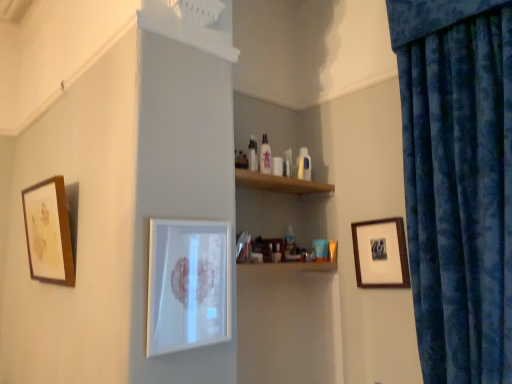
This screenshot has width=512, height=384. I want to click on velvety blue curtain at right, so click(458, 182).

How much space does wooden framed print at right, the third picture frame in the left-to-right sequence, occupy horizontally?

wooden framed print at right, the third picture frame in the left-to-right sequence, is 1.50 inches wide.

What do you see at coordinates (188, 285) in the screenshot? I see `white glossy picture frame at center, the 2th picture frame from the left` at bounding box center [188, 285].

Where is `velvety blue curtain at right`? The width and height of the screenshot is (512, 384). velvety blue curtain at right is located at coordinates (458, 182).

Is wooden framed print at right, the third picture frame in the left-to-right sequence, in front of or behind wooden framed artwork at left, positioned as the 3th picture frame in right-to-left order, in the image?

In the image, wooden framed print at right, the third picture frame in the left-to-right sequence, appears behind wooden framed artwork at left, positioned as the 3th picture frame in right-to-left order.

Is wooden framed print at right, which is the 1th picture frame in right-to-left order, positioned with its back to wooden framed artwork at left, the first picture frame from the left?

No.

Is wooden framed print at right, which is the 1th picture frame in right-to-left order, bigger than wooden framed artwork at left, the first picture frame from the left?

Actually, wooden framed print at right, which is the 1th picture frame in right-to-left order, might be smaller than wooden framed artwork at left, the first picture frame from the left.

Considering the relative sizes of wooden framed print at right, which is the 1th picture frame in right-to-left order, and wooden framed artwork at left, the first picture frame from the left, in the image provided, is wooden framed print at right, which is the 1th picture frame in right-to-left order, wider than wooden framed artwork at left, the first picture frame from the left,?

No, wooden framed print at right, which is the 1th picture frame in right-to-left order, is not wider than wooden framed artwork at left, the first picture frame from the left.

Is wooden framed print at right, which is the 1th picture frame in right-to-left order, thinner than velvety blue curtain at right?

Indeed, wooden framed print at right, which is the 1th picture frame in right-to-left order, has a lesser width compared to velvety blue curtain at right.

Is there a large distance between wooden framed print at right, which is the 1th picture frame in right-to-left order, and velvety blue curtain at right?

wooden framed print at right, which is the 1th picture frame in right-to-left order, is actually quite close to velvety blue curtain at right.

From a real-world perspective, relative to velvety blue curtain at right, is wooden framed print at right, the third picture frame in the left-to-right sequence, vertically above or below?

wooden framed print at right, the third picture frame in the left-to-right sequence, is below velvety blue curtain at right.

From the image's perspective, which is below, wooden framed print at right, which is the 1th picture frame in right-to-left order, or velvety blue curtain at right?

wooden framed print at right, which is the 1th picture frame in right-to-left order, appears lower in the image.

Considering the positions of objects wooden framed print at right, which is the 1th picture frame in right-to-left order, and white glossy picture frame at center, the 2th picture frame from the left, in the image provided, who is behind, wooden framed print at right, which is the 1th picture frame in right-to-left order, or white glossy picture frame at center, the 2th picture frame from the left,?

wooden framed print at right, which is the 1th picture frame in right-to-left order, is behind.

From the picture: How different are the orientations of wooden framed print at right, which is the 1th picture frame in right-to-left order, and white glossy picture frame at center, placed as the 2th picture frame when sorted from right to left, in degrees?

They differ by 89.9 degrees in their facing directions.

Identify the location of picture frame located underneath the wooden framed print at right, the third picture frame in the left-to-right sequence (from a real-world perspective). (188, 285).

From a real-world perspective, is wooden framed print at right, the third picture frame in the left-to-right sequence, above or below white glossy picture frame at center, the 2th picture frame from the left?

From a real-world perspective, wooden framed print at right, the third picture frame in the left-to-right sequence, is physically above white glossy picture frame at center, the 2th picture frame from the left.

From a real-world perspective, is wooden framed artwork at left, the first picture frame from the left, below white glossy picture frame at center, the 2th picture frame from the left?

No.

From the image's perspective, which object appears higher, wooden framed artwork at left, the first picture frame from the left, or white glossy picture frame at center, placed as the 2th picture frame when sorted from right to left?

wooden framed artwork at left, the first picture frame from the left, appears higher in the image.

Does wooden framed artwork at left, the first picture frame from the left, lie in front of white glossy picture frame at center, placed as the 2th picture frame when sorted from right to left?

No, wooden framed artwork at left, the first picture frame from the left, is further to the viewer.

In terms of width, does white glossy picture frame at center, placed as the 2th picture frame when sorted from right to left, look wider or thinner when compared to velvety blue curtain at right?

white glossy picture frame at center, placed as the 2th picture frame when sorted from right to left, is thinner than velvety blue curtain at right.

From the image's perspective, which one is positioned lower, white glossy picture frame at center, the 2th picture frame from the left, or velvety blue curtain at right?

white glossy picture frame at center, the 2th picture frame from the left.

Considering their positions, is white glossy picture frame at center, placed as the 2th picture frame when sorted from right to left, located in front of or behind velvety blue curtain at right?

white glossy picture frame at center, placed as the 2th picture frame when sorted from right to left, is behind velvety blue curtain at right.

Are white glossy picture frame at center, the 2th picture frame from the left, and velvety blue curtain at right located far from each other?

No, white glossy picture frame at center, the 2th picture frame from the left, is not far away from velvety blue curtain at right.

Considering the relative positions of velvety blue curtain at right and white glossy picture frame at center, the 2th picture frame from the left, in the image provided, is velvety blue curtain at right to the right of white glossy picture frame at center, the 2th picture frame from the left, from the viewer's perspective?

Indeed, velvety blue curtain at right is positioned on the right side of white glossy picture frame at center, the 2th picture frame from the left.

What's the angular difference between velvety blue curtain at right and white glossy picture frame at center, placed as the 2th picture frame when sorted from right to left,'s facing directions?

The angular difference between velvety blue curtain at right and white glossy picture frame at center, placed as the 2th picture frame when sorted from right to left, is 89.3 degrees.

Which object is thinner, velvety blue curtain at right or white glossy picture frame at center, the 2th picture frame from the left?

white glossy picture frame at center, the 2th picture frame from the left, is thinner.

Does velvety blue curtain at right contain white glossy picture frame at center, placed as the 2th picture frame when sorted from right to left?

Actually, white glossy picture frame at center, placed as the 2th picture frame when sorted from right to left, is outside velvety blue curtain at right.

Looking at this image, can you confirm if white glossy picture frame at center, placed as the 2th picture frame when sorted from right to left, is taller than wooden framed artwork at left, the first picture frame from the left?

Indeed, white glossy picture frame at center, placed as the 2th picture frame when sorted from right to left, has a greater height compared to wooden framed artwork at left, the first picture frame from the left.

Which of these two, white glossy picture frame at center, the 2th picture frame from the left, or wooden framed artwork at left, positioned as the 3th picture frame in right-to-left order, is wider?

With larger width is wooden framed artwork at left, positioned as the 3th picture frame in right-to-left order.

Is white glossy picture frame at center, the 2th picture frame from the left, at the right side of wooden framed artwork at left, the first picture frame from the left?

Indeed, white glossy picture frame at center, the 2th picture frame from the left, is positioned on the right side of wooden framed artwork at left, the first picture frame from the left.

From a real-world perspective, is white glossy picture frame at center, placed as the 2th picture frame when sorted from right to left, located beneath wooden framed artwork at left, positioned as the 3th picture frame in right-to-left order?

Yes, from a real-world perspective, white glossy picture frame at center, placed as the 2th picture frame when sorted from right to left, is below wooden framed artwork at left, positioned as the 3th picture frame in right-to-left order.

From the image's perspective, starting from the wooden framed artwork at left, positioned as the 3th picture frame in right-to-left order, which picture frame is the 1st one below? Please provide its 2D coordinates.

[(380, 253)]

There is a wooden framed print at right, the third picture frame in the left-to-right sequence. Identify the location of curtain above it (from a real-world perspective). The width and height of the screenshot is (512, 384). (458, 182).

From the image, which object appears to be nearer to wooden framed print at right, which is the 1th picture frame in right-to-left order, velvety blue curtain at right or wooden framed artwork at left, the first picture frame from the left?

velvety blue curtain at right.

When comparing their distances from wooden framed artwork at left, the first picture frame from the left, does velvety blue curtain at right or white glossy picture frame at center, placed as the 2th picture frame when sorted from right to left, seem further?

velvety blue curtain at right.

When comparing their distances from white glossy picture frame at center, placed as the 2th picture frame when sorted from right to left, does wooden framed print at right, which is the 1th picture frame in right-to-left order, or velvety blue curtain at right seem further?

velvety blue curtain at right lies further to white glossy picture frame at center, placed as the 2th picture frame when sorted from right to left, than the other object.

When comparing their distances from wooden framed print at right, the third picture frame in the left-to-right sequence, does wooden framed artwork at left, positioned as the 3th picture frame in right-to-left order, or velvety blue curtain at right seem closer?

The object closer to wooden framed print at right, the third picture frame in the left-to-right sequence, is velvety blue curtain at right.

Based on their spatial positions, is wooden framed print at right, the third picture frame in the left-to-right sequence, or white glossy picture frame at center, the 2th picture frame from the left, further from velvety blue curtain at right?

The object further to velvety blue curtain at right is white glossy picture frame at center, the 2th picture frame from the left.

Which object lies nearer to the anchor point velvety blue curtain at right, wooden framed print at right, which is the 1th picture frame in right-to-left order, or wooden framed artwork at left, the first picture frame from the left?

wooden framed print at right, which is the 1th picture frame in right-to-left order, is closer to velvety blue curtain at right.

Based on their spatial positions, is wooden framed artwork at left, positioned as the 3th picture frame in right-to-left order, or white glossy picture frame at center, placed as the 2th picture frame when sorted from right to left, further from velvety blue curtain at right?

wooden framed artwork at left, positioned as the 3th picture frame in right-to-left order, is positioned further to the anchor velvety blue curtain at right.

When comparing their distances from wooden framed print at right, which is the 1th picture frame in right-to-left order, does wooden framed artwork at left, the first picture frame from the left, or white glossy picture frame at center, the 2th picture frame from the left, seem closer?

white glossy picture frame at center, the 2th picture frame from the left.

Where is `picture frame between wooden framed artwork at left, positioned as the 3th picture frame in right-to-left order, and wooden framed print at right, the third picture frame in the left-to-right sequence, in the horizontal direction`? Image resolution: width=512 pixels, height=384 pixels. picture frame between wooden framed artwork at left, positioned as the 3th picture frame in right-to-left order, and wooden framed print at right, the third picture frame in the left-to-right sequence, in the horizontal direction is located at coordinates (188, 285).

Image resolution: width=512 pixels, height=384 pixels. In order to click on picture frame between white glossy picture frame at center, placed as the 2th picture frame when sorted from right to left, and velvety blue curtain at right, in the horizontal direction in this screenshot , I will do `click(380, 253)`.